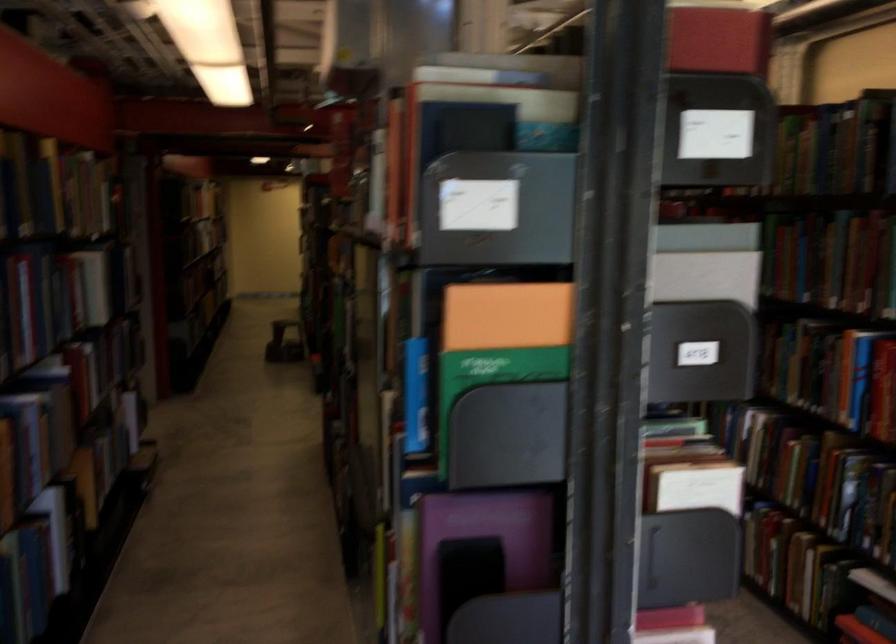
Identify the location of orange book. (506, 315).